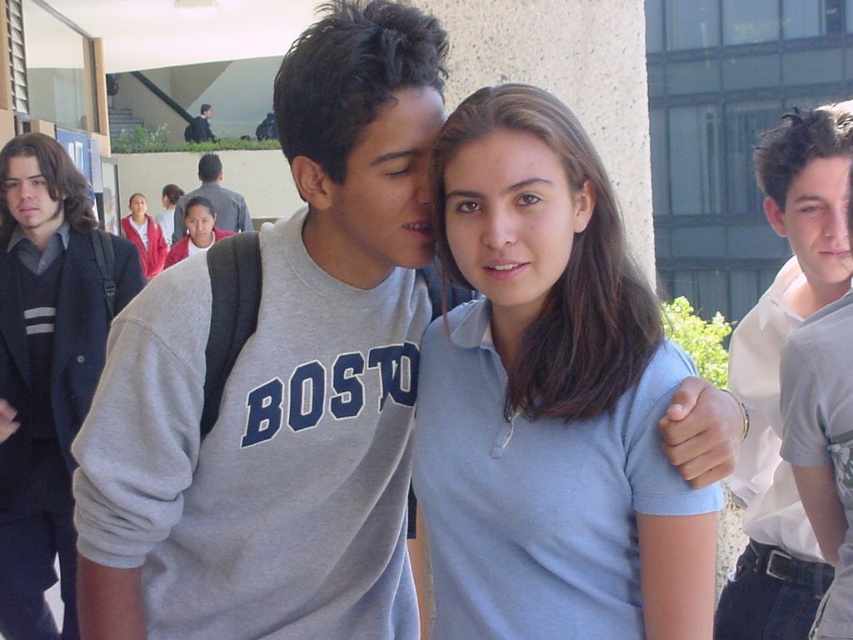
Between gray sweatshirt at center and white cotton shirt at upper right, which one appears on the left side from the viewer's perspective?

Positioned to the left is gray sweatshirt at center.

Which of these two, gray sweatshirt at center or white cotton shirt at upper right, stands taller?

Standing taller between the two is gray sweatshirt at center.

Between point (247, 419) and point (798, 186), which one is positioned in front?

Point (247, 419)

Locate an element on the screen. This screenshot has width=853, height=640. gray sweatshirt at center is located at coordinates (280, 380).

Based on the photo, is gray sweatshirt at center to the left of dark gray backpack at upper left from the viewer's perspective?

Incorrect, gray sweatshirt at center is not on the left side of dark gray backpack at upper left.

Which is above, gray sweatshirt at center or dark gray backpack at upper left?

dark gray backpack at upper left is higher up.

Locate an element on the screen. The height and width of the screenshot is (640, 853). gray sweatshirt at center is located at coordinates (280, 380).

Where is `gray sweatshirt at center`? This screenshot has height=640, width=853. gray sweatshirt at center is located at coordinates (280, 380).

Find the location of a particular element. This screenshot has width=853, height=640. matte pink shirt at center is located at coordinates (195, 230).

Is point (186, 220) farther from viewer compared to point (207, 125)?

No, it is not.

Does point (178, 250) lie behind point (209, 131)?

No, (178, 250) is in front of (209, 131).

Where is `matte pink shirt at center`? This screenshot has height=640, width=853. matte pink shirt at center is located at coordinates (195, 230).